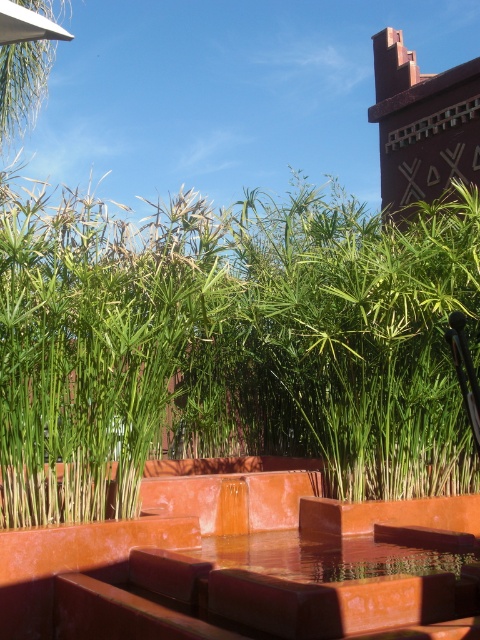
Is point (59, 211) positioned behind point (286, 545)?

No, it is not.

The width and height of the screenshot is (480, 640). What do you see at coordinates (230, 344) in the screenshot?
I see `green leafy plant at center` at bounding box center [230, 344].

Which is in front, point (145, 417) or point (354, 561)?

Point (354, 561) is in front.

This screenshot has width=480, height=640. In order to click on green leafy plant at center in this screenshot , I will do `click(230, 344)`.